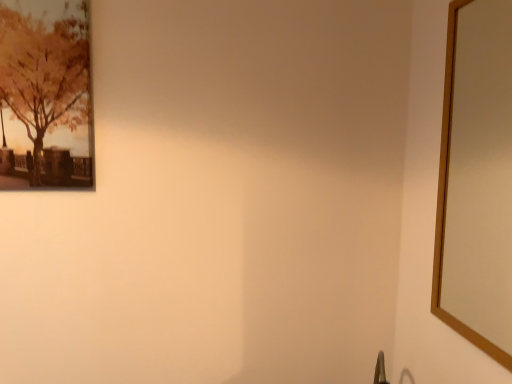
This screenshot has height=384, width=512. What do you see at coordinates (446, 202) in the screenshot?
I see `wooden picture frame at right` at bounding box center [446, 202].

Find the location of a particular element. The image size is (512, 384). wooden picture frame at right is located at coordinates (446, 202).

This screenshot has height=384, width=512. I want to click on wooden picture frame at right, so click(x=446, y=202).